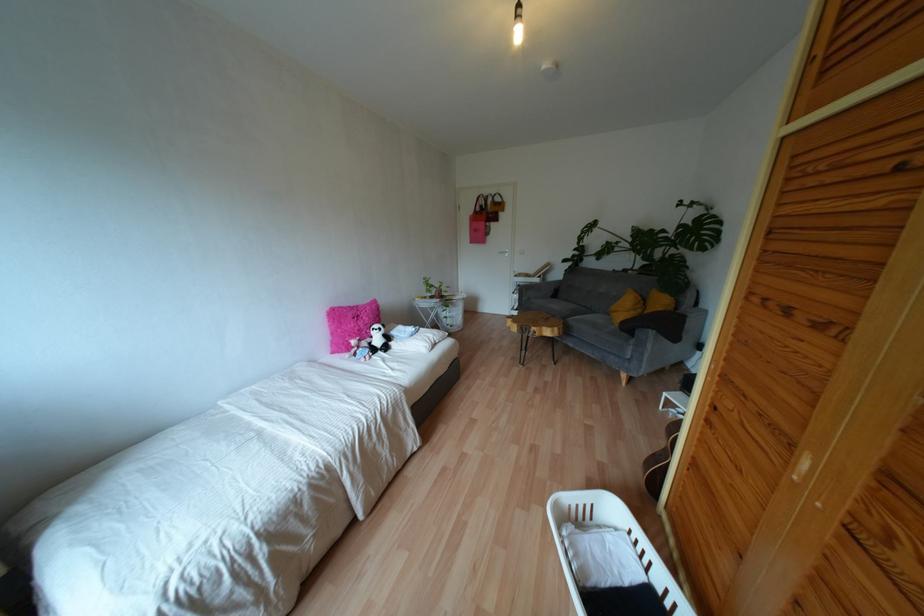
Identify the location of white laundry basket. Image resolution: width=924 pixels, height=616 pixels. (610, 557).